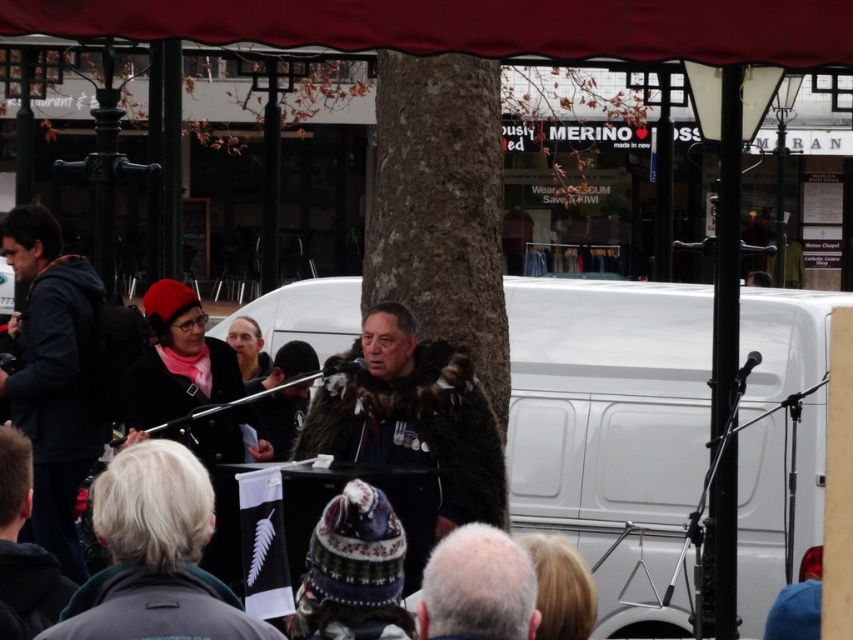
You are attending an outdoor event and notice the white matte van at center and the gray woolen hat at lower center. From the perspective of someone standing in front of the speaker, which object is located to the right?

The white matte van at center is positioned on the right side of gray woolen hat at lower center, so from the speaker perspective, the white matte van at center would be to the right of the gray woolen hat at lower center.

You are standing at point [471,620] and want to move towards the speaker who is at point [554,500]. Is the speaker in front of or behind you?

The speaker at point [554,500] is behind point [471,620], so the speaker is behind you.